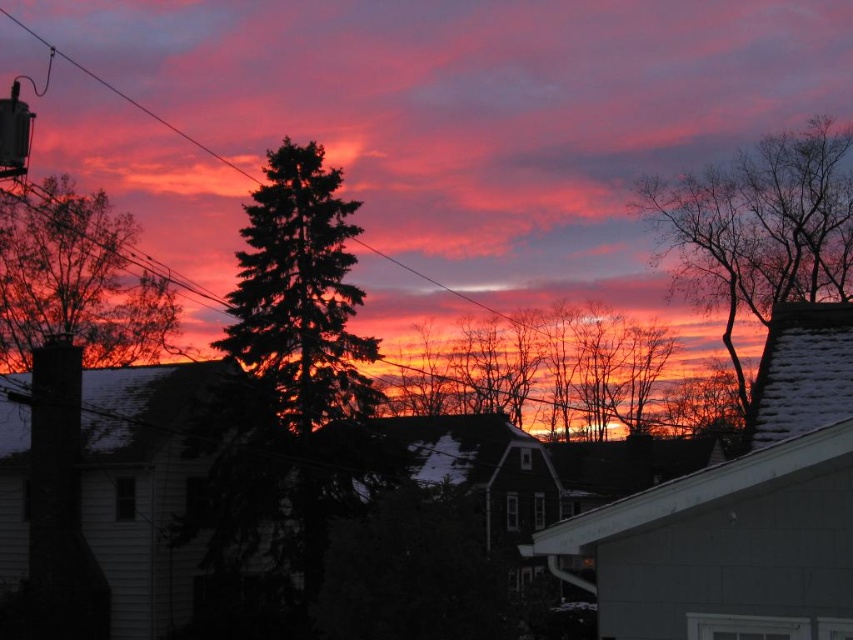
Is green textured pine tree at center further to camera compared to silhouette evergreen tree at left?

No, green textured pine tree at center is closer to the viewer.

How far apart are green textured pine tree at center and silhouette evergreen tree at left?

green textured pine tree at center is 41.61 meters away from silhouette evergreen tree at left.

Is point (299, 221) positioned in front of point (102, 291)?

Yes, it is.

This screenshot has height=640, width=853. I want to click on green textured pine tree at center, so click(300, 292).

Between bare branches at upper right and silhouette evergreen tree at left, which one appears on the left side from the viewer's perspective?

silhouette evergreen tree at left

Between bare branches at upper right and silhouette evergreen tree at left, which one is positioned lower?

silhouette evergreen tree at left is below.

Where is `bare branches at upper right`? bare branches at upper right is located at coordinates (759, 228).

Looking at this image, can you confirm if silhouette bare tree at center is bigger than bare branches at upper right?

Incorrect, silhouette bare tree at center is not larger than bare branches at upper right.

Between silhouette bare tree at center and bare branches at upper right, which one appears on the right side from the viewer's perspective?

bare branches at upper right is more to the right.

This screenshot has width=853, height=640. What do you see at coordinates (563, 376) in the screenshot?
I see `silhouette bare tree at center` at bounding box center [563, 376].

You are a GUI agent. You are given a task and a screenshot of the screen. Output one action in this format:
    pyautogui.click(x=<x>, y=<y>)
    Task: Click on the silhouette bare tree at center
    The width and height of the screenshot is (853, 640).
    Given the screenshot: What is the action you would take?
    pyautogui.click(x=563, y=376)